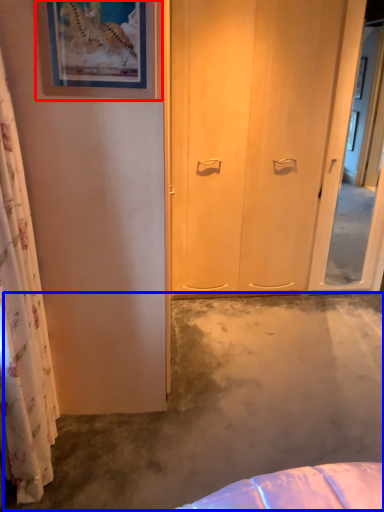
Question: Among these objects, which one is nearest to the camera, picture frame (highlighted by a red box) or concrete (highlighted by a blue box)?

Choices:
 (A) picture frame
 (B) concrete

Answer: (A)